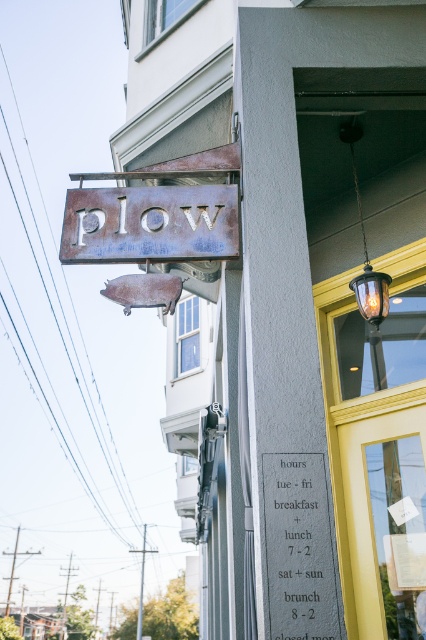
You are standing in front of the Plow building and need to hang a new menu board. The menu board is 1.2 meters wide. There is a rustic metal sign at upper center and a translucent glass lamp at upper center. Can the menu board fit between them if they are spaced 1.5 meters apart?

The rustic metal sign at upper center might be wider than the translucent glass lamp at upper center. If the spacing between them is 1.5 meters, the menu board which is 1.2 meters wide could fit as the available space is larger than the board.

You are standing in front of the Plow building and want to hang a new menu board between the rustic metal sign at upper center and the translucent glass lamp at upper center. The menu board is 18 inches wide. Is there enough space between them to fit the menu board without overlapping either object?

The rustic metal sign at upper center is 26.64 inches away from the translucent glass lamp at upper center. Since the menu board is 18 inches wide, there is sufficient space between them to fit the menu board without overlapping either object.

You are standing in front of the building named Plow and want to take a photo of the metal sign and the plaque with business hours. Which point, point (x=276, y=477) or point (x=382, y=310), should you focus on to ensure the metal sign and the plaque are in sharp focus?

You should focus on point (x=276, y=477) because it is closer to the viewer than point (x=382, y=310), so focusing there will ensure the metal sign and plaque are in sharp focus.